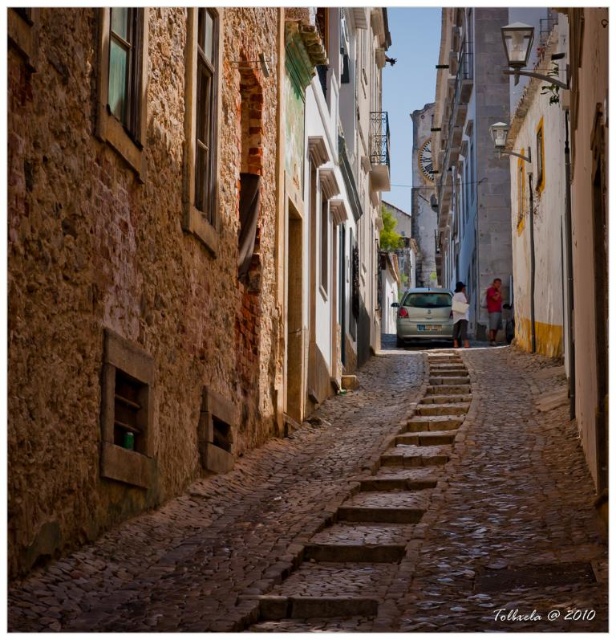
Is point (314, 580) closer to viewer compared to point (447, 330)?

Yes, point (314, 580) is in front of point (447, 330).

Does brown cobblestone stairs at center have a greater width compared to light beige metallic car at center?

Yes, brown cobblestone stairs at center is wider than light beige metallic car at center.

Does point (383, 524) come closer to viewer compared to point (415, 296)?

That is True.

The width and height of the screenshot is (616, 640). What are the coordinates of `brown cobblestone stairs at center` in the screenshot? It's located at (370, 518).

Does point (450, 534) come farther from viewer compared to point (387, 586)?

Yes, it is.

Identify the location of brown cobblestone path at center. (365, 520).

Which of these two, brown cobblestone path at center or light beige metallic car at center, stands taller?

light beige metallic car at center

Does brown cobblestone path at center have a greater width compared to light beige metallic car at center?

Correct, the width of brown cobblestone path at center exceeds that of light beige metallic car at center.

I want to click on brown cobblestone path at center, so click(x=365, y=520).

Image resolution: width=616 pixels, height=640 pixels. Identify the location of brown cobblestone path at center. (365, 520).